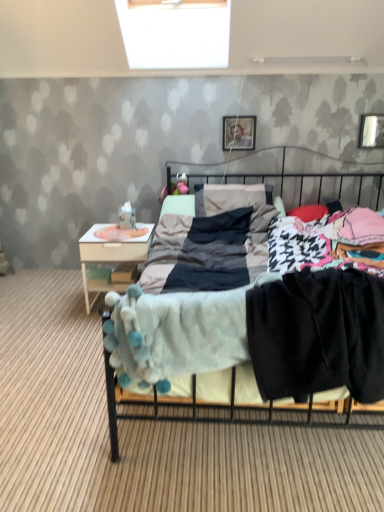
Question: Is white wood nightstand at left in front of or behind wooden photo frame at upper center, which appears as the first picture frame when viewed from the left, in the image?

Choices:
 (A) front
 (B) behind

Answer: (A)

Question: From the image's perspective, is white wood nightstand at left positioned above or below wooden photo frame at upper center, the 2th picture frame positioned from the right?

Choices:
 (A) above
 (B) below

Answer: (B)

Question: Which object is the closest to the soft gray blanket at center?

Choices:
 (A) white plush toy at upper left
 (B) wooden photo frame at upper center, the 2th picture frame positioned from the right
 (C) black cotton pants at lower right
 (D) white wood nightstand at left
 (E) metallic rectangular frame at upper right, which is counted as the second picture frame, starting from the left

Answer: (B)

Question: Estimate the real-world distances between objects in this image. Which object is closer to the metallic rectangular frame at upper right, which is counted as the second picture frame, starting from the left?

Choices:
 (A) black cotton pants at lower right
 (B) wooden photo frame at upper center, the 2th picture frame positioned from the right
 (C) white plush toy at upper left
 (D) white wood nightstand at left
 (E) soft gray blanket at center

Answer: (E)